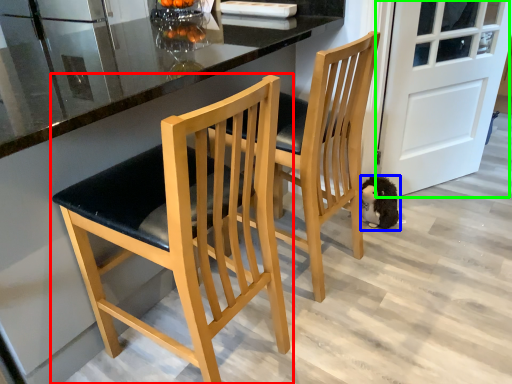
Question: Which object is positioned farthest from chair (highlighted by a red box)? Select from animal (highlighted by a blue box) and door (highlighted by a green box).

Choices:
 (A) animal
 (B) door

Answer: (B)